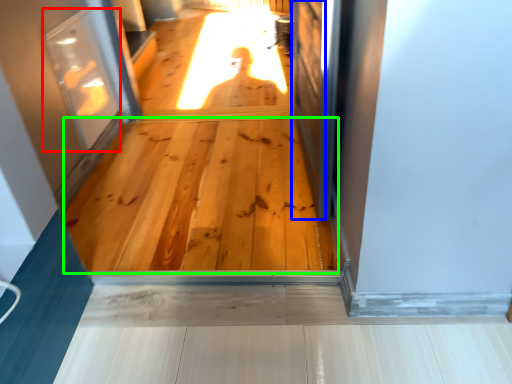
Question: Which is farther away from screen door (highlighted by a red box)? screen door (highlighted by a blue box) or hardwood (highlighted by a green box)?

Choices:
 (A) screen door
 (B) hardwood

Answer: (A)